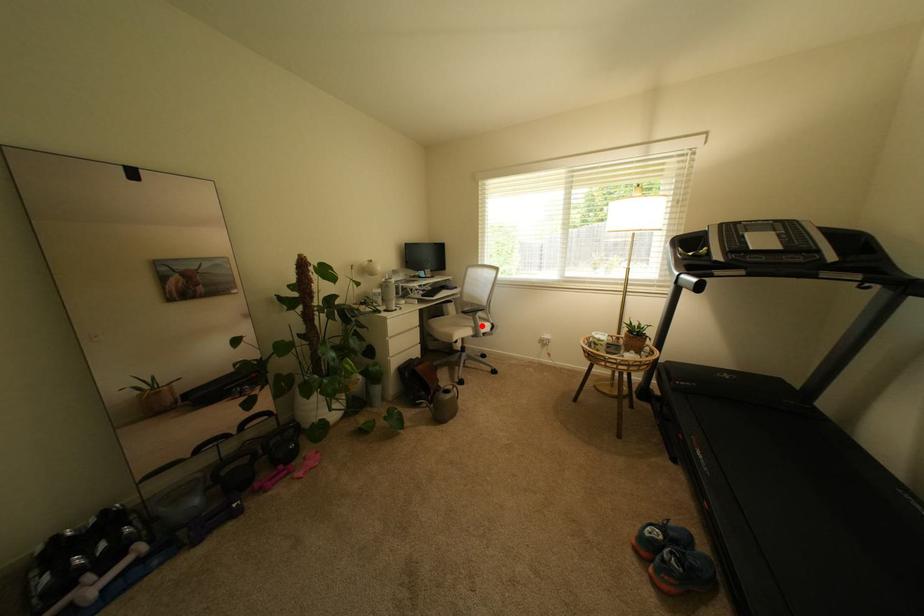
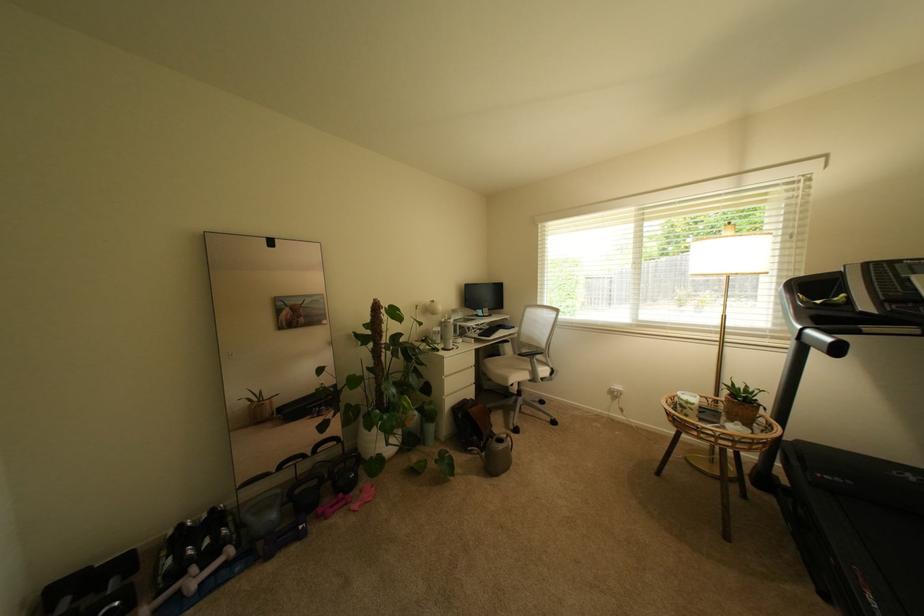
Question: I am providing you with two images of the same scene from different viewpoints. Image1 has a red point marked. In image2, the corresponding 3D location appears at what relative position? Reply with the corresponding letter.

Choices:
 (A) Closer
 (B) Farther

Answer: (B)